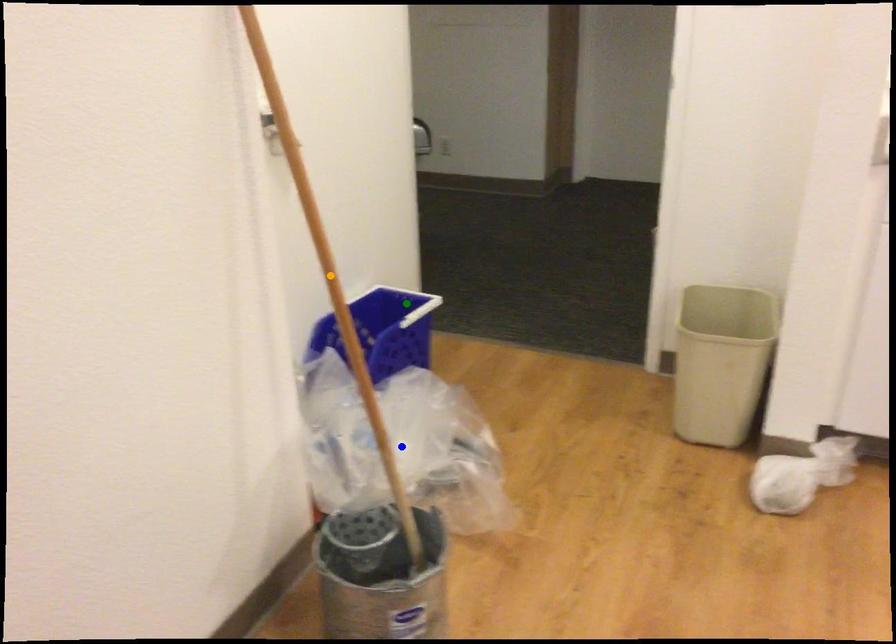
Order these from nearest to farthest:
blue point
green point
orange point

orange point < blue point < green point